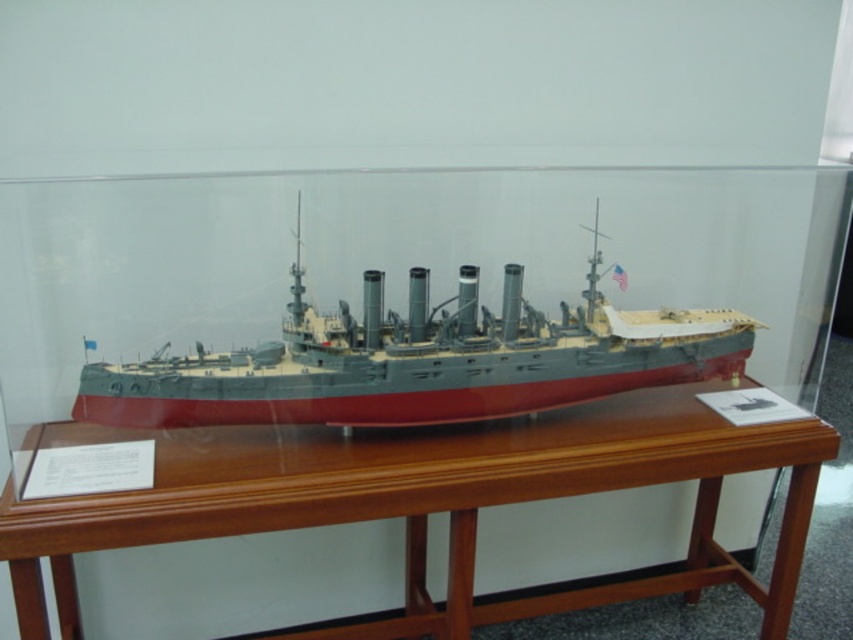
Is brown polished wood table at center closer to camera compared to gray metallic ship at center?

Yes, it is.

Is brown polished wood table at center to the right of gray metallic ship at center from the viewer's perspective?

In fact, brown polished wood table at center is to the left of gray metallic ship at center.

Does point (657, 588) come behind point (705, 355)?

Yes.

The width and height of the screenshot is (853, 640). I want to click on brown polished wood table at center, so [x=422, y=499].